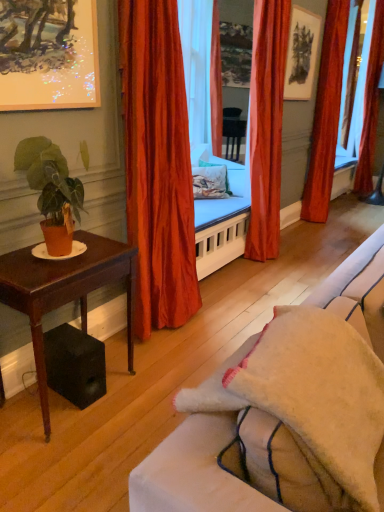
Identify the location of vacant area that lies between satin orange curtain at center, positioned as the 1th curtain in front-to-back order, and mahogany wood side table at left. (141, 349).